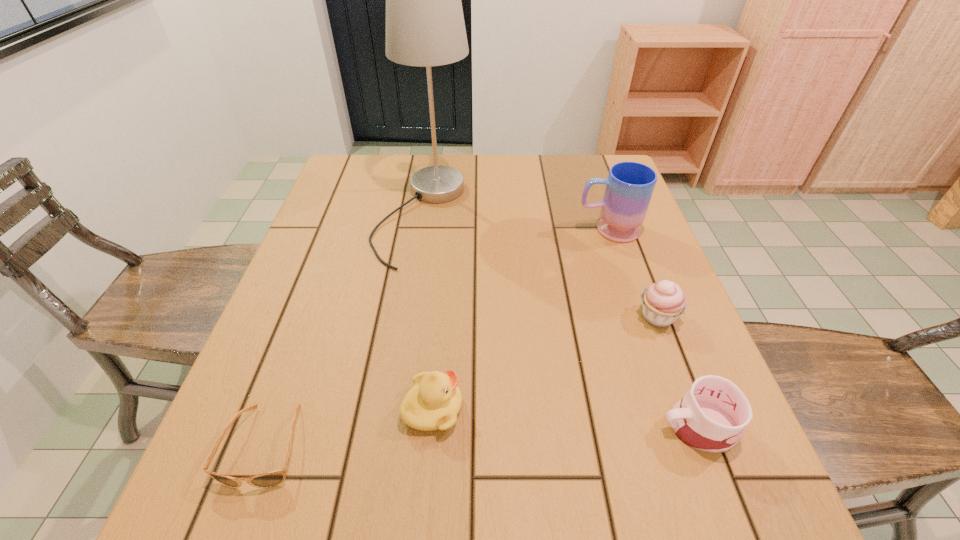
In order to click on vacant position located 0.400m on the side of the taller mug with the handle in this screenshot , I will do `click(424, 230)`.

This screenshot has height=540, width=960. I want to click on free space located on the side of the taller mug with the handle, so click(444, 230).

The width and height of the screenshot is (960, 540). I want to click on free space located 0.060m on the back of the cupcake, so click(644, 281).

The image size is (960, 540). What are the coordinates of `vacant space located on the beak of the duckling` in the screenshot? It's located at (580, 408).

You are a GUI agent. You are given a task and a screenshot of the screen. Output one action in this format:
    pyautogui.click(x=<x>, y=<y>)
    Task: Click on the vacant position located on the side with the handle of the shorter mug
    Image resolution: width=960 pixels, height=540 pixels.
    Given the screenshot: What is the action you would take?
    pyautogui.click(x=510, y=426)

Find the location of a particular element. Image resolution: width=960 pixels, height=540 pixels. vacant point located 0.210m on the side with the handle of the shorter mug is located at coordinates (539, 426).

Image resolution: width=960 pixels, height=540 pixels. Find the location of `free spot located on the side with the handle of the shorter mug`. free spot located on the side with the handle of the shorter mug is located at coordinates (544, 426).

Find the location of a particular element. object that is at the far edge is located at coordinates (425, 27).

At what (x,y) coordinates should I click in order to perform the action: click on object at the near edge. Please return your answer as a coordinate pair (x, y). Looking at the image, I should click on (270, 479).

Locate an element on the screen. The image size is (960, 540). table lamp located at the left edge is located at coordinates (425, 27).